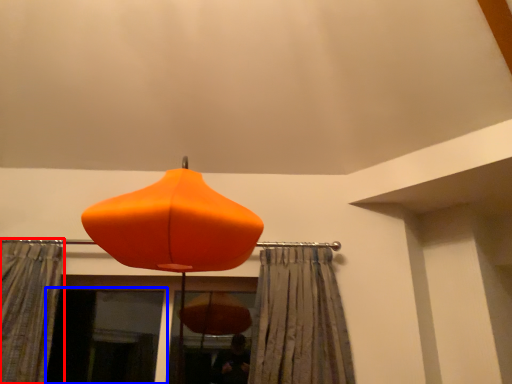
Question: Which of the following is the closest to the observer, curtain (highlighted by a red box) or screen door (highlighted by a blue box)?

Choices:
 (A) curtain
 (B) screen door

Answer: (A)